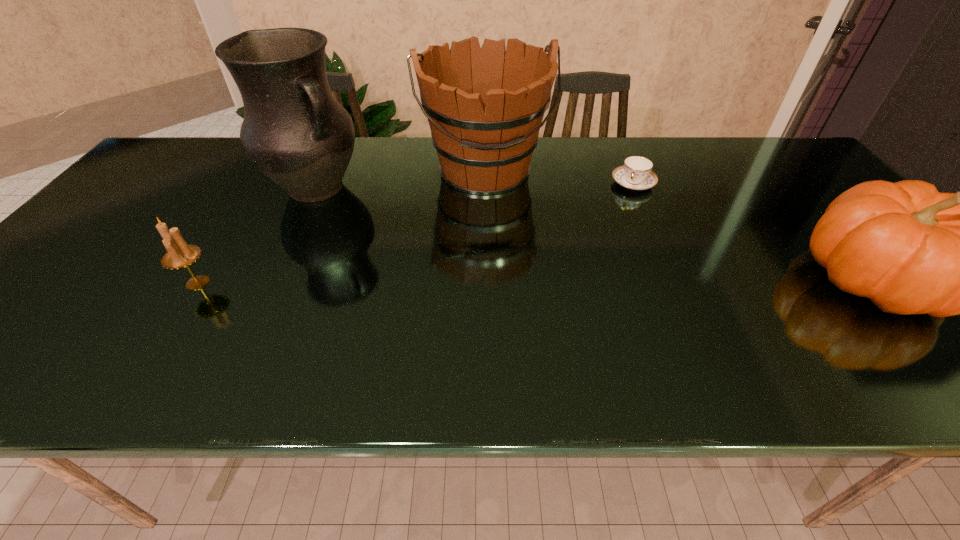
Identify the location of the fourth tallest object. The height and width of the screenshot is (540, 960). (179, 254).

Find the location of a particular element. the second object from right to left is located at coordinates (635, 174).

Locate an element on the screen. The height and width of the screenshot is (540, 960). teacup is located at coordinates (635, 174).

What are the coordinates of `the third object from right to left` in the screenshot? It's located at (485, 105).

You are a GUI agent. You are given a task and a screenshot of the screen. Output one action in this format:
    pyautogui.click(x=<x>, y=<y>)
    Task: Click on the pitcher
    The image size is (960, 540).
    Given the screenshot: What is the action you would take?
    pos(294,130)

Where is `vacant space located on the back of the second shortest object`? vacant space located on the back of the second shortest object is located at coordinates (231, 230).

The height and width of the screenshot is (540, 960). I want to click on vacant space located 0.240m on the side with the handle of the teacup, so click(599, 244).

The image size is (960, 540). I want to click on vacant space situated on the side with the handle of the teacup, so click(594, 254).

At what (x,y) coordinates should I click in order to perform the action: click on free space located on the side with the handle of the teacup. Please return your answer as a coordinate pair (x, y). Image resolution: width=960 pixels, height=540 pixels. Looking at the image, I should click on (612, 222).

This screenshot has width=960, height=540. What are the coordinates of `vacant region located 0.130m with the handle on the wine bucket` in the screenshot? It's located at (507, 238).